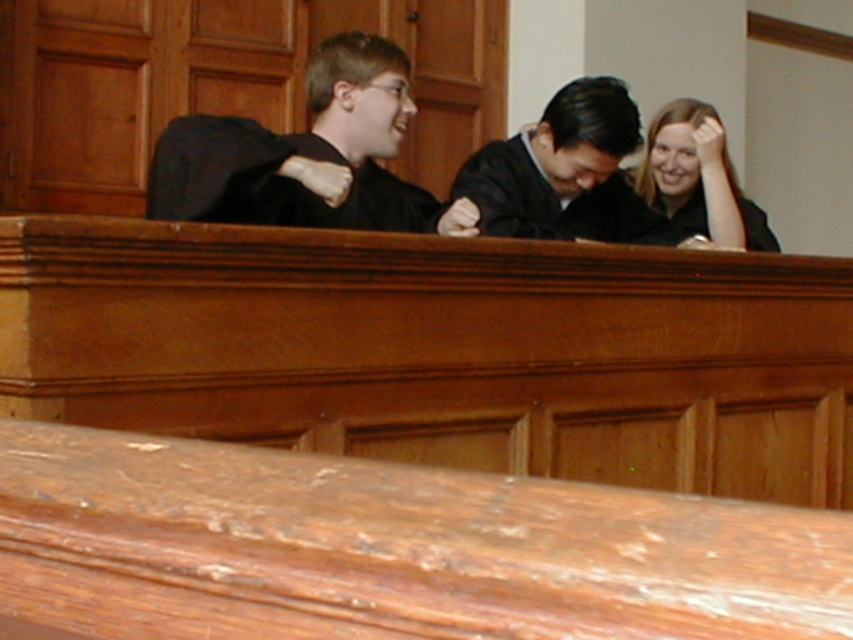
Question: Which of these objects is positioned closest to the black matte/black suit at left?

Choices:
 (A) matte black shirt at upper right
 (B) black matte robe at center

Answer: (B)

Question: From the image, what is the correct spatial relationship of black matte robe at center in relation to matte black shirt at upper right?

Choices:
 (A) below
 (B) above

Answer: (A)

Question: Based on their relative distances, which object is nearer to the black matte robe at center?

Choices:
 (A) black matte/black suit at left
 (B) matte black shirt at upper right

Answer: (B)

Question: Where is black matte robe at center located in relation to matte black shirt at upper right in the image?

Choices:
 (A) left
 (B) right

Answer: (A)

Question: Can you confirm if black matte robe at center is positioned below black matte robe at left?

Choices:
 (A) no
 (B) yes

Answer: (A)

Question: Among these objects, which one is farthest from the camera?

Choices:
 (A) matte black shirt at upper right
 (B) black matte robe at center
 (C) black matte robe at left

Answer: (A)